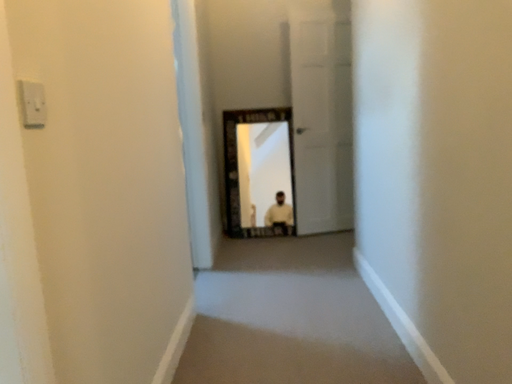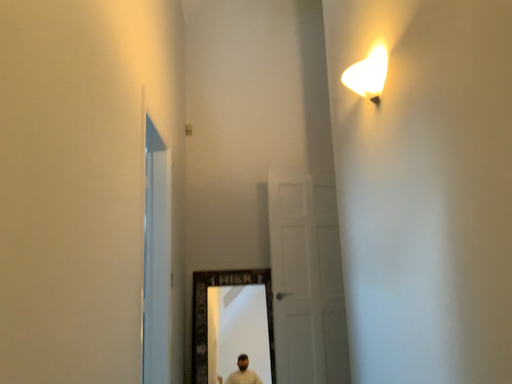
Question: How did the camera likely rotate when shooting the video?

Choices:
 (A) rotated upward
 (B) rotated downward

Answer: (A)